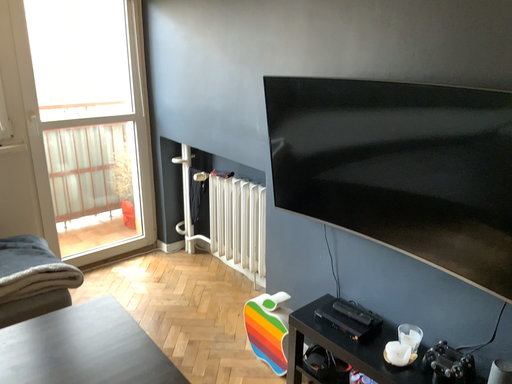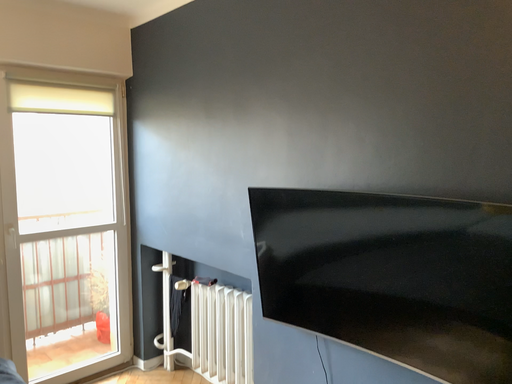
Question: Which way did the camera rotate in the video?

Choices:
 (A) rotated upward
 (B) rotated downward

Answer: (A)